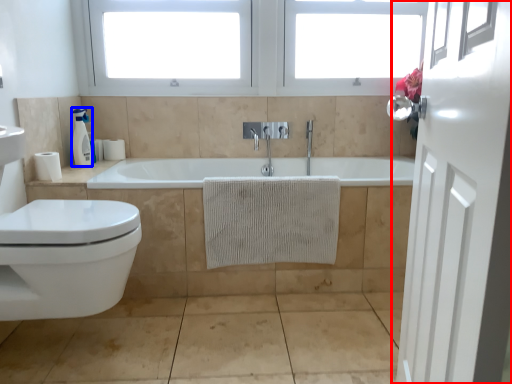
Question: Which of the following is the farthest to the observer, door (highlighted by a red box) or soap dispenser (highlighted by a blue box)?

Choices:
 (A) door
 (B) soap dispenser

Answer: (B)